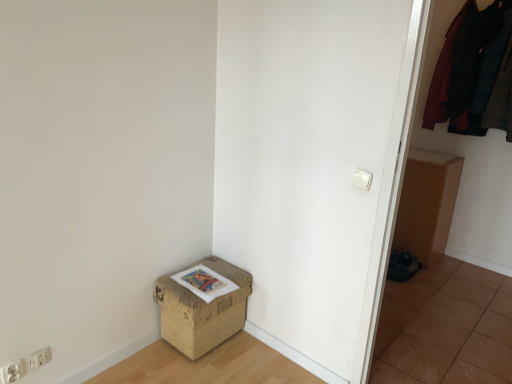
Find the location of `blank space above brown cardboard box at lower left (from a real-world perspective)`. blank space above brown cardboard box at lower left (from a real-world perspective) is located at coordinates (203, 278).